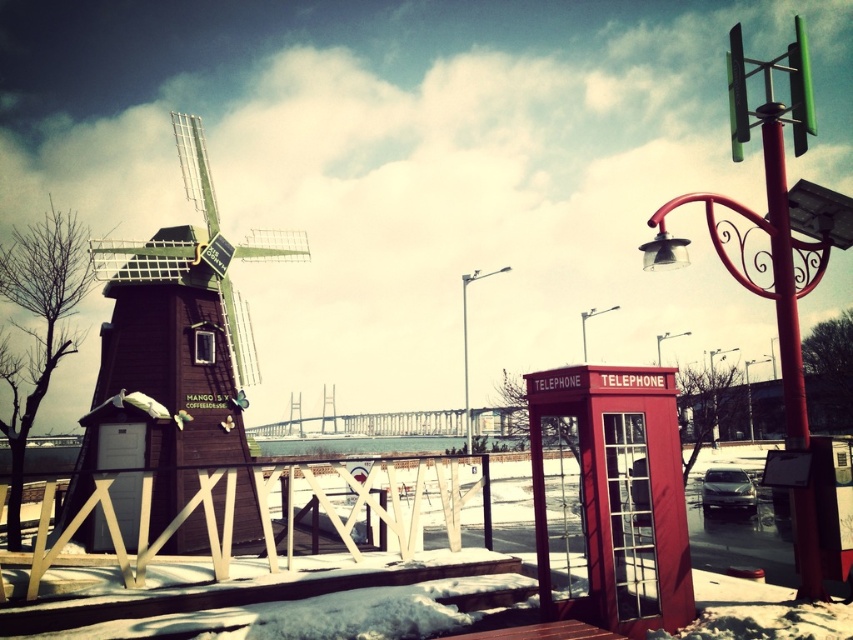
Based on the photo, which is more to the right, matte red telephone booth at right or red metallic pole at upper right?

From the viewer's perspective, red metallic pole at upper right appears more on the right side.

Does point (614, 545) come in front of point (779, 336)?

Yes, it is.

Where is `matte red telephone booth at right`? This screenshot has height=640, width=853. matte red telephone booth at right is located at coordinates (613, 497).